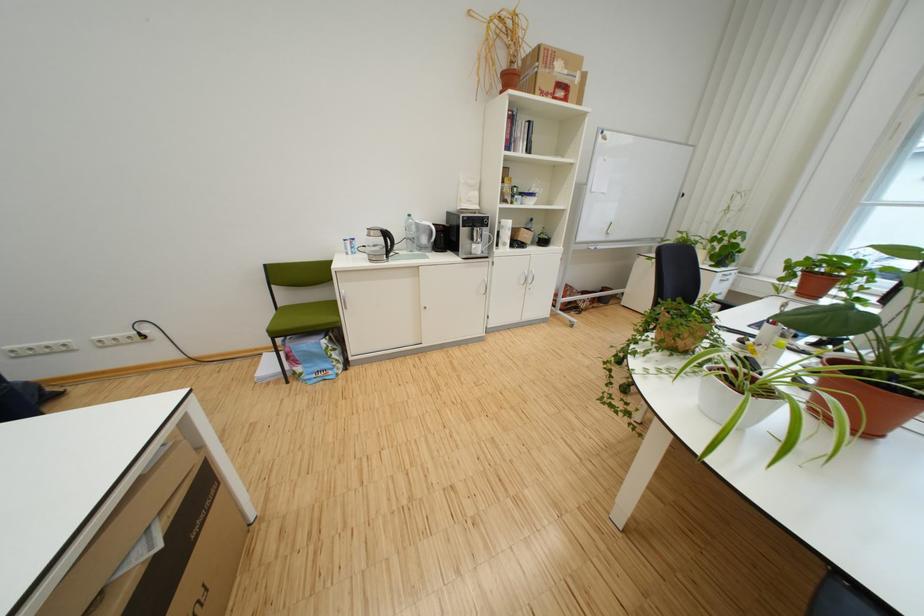
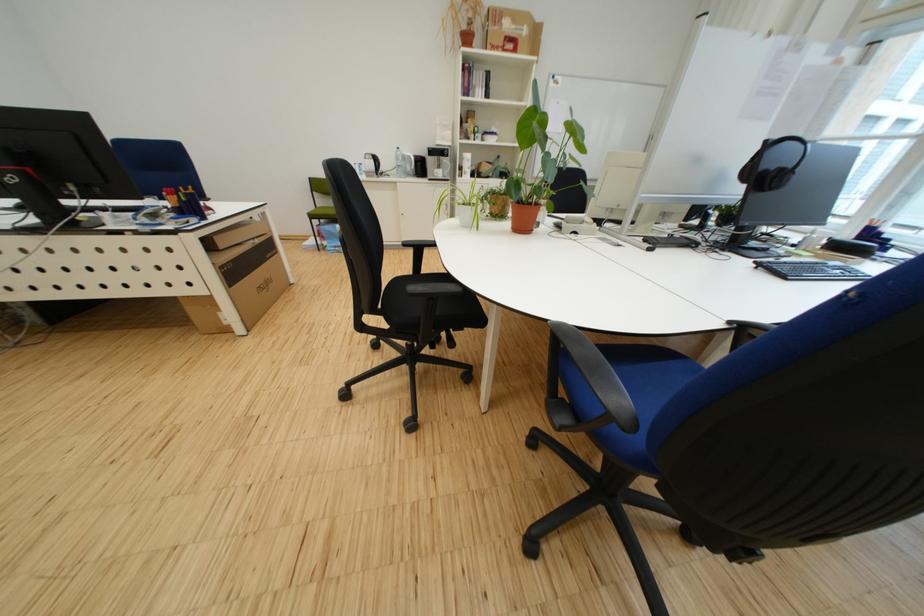
The point at (286, 336) is marked in the first image. Where is the corresponding point in the second image?

(323, 219)